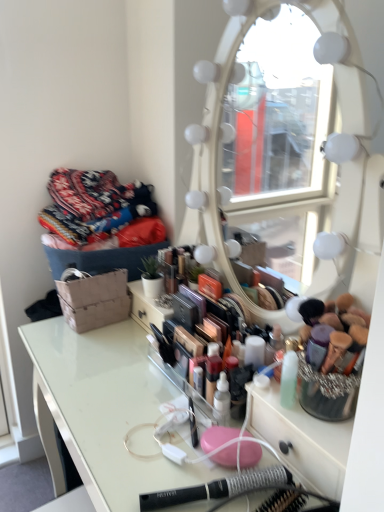
Question: From a real-world perspective, is knitted fabric pile at upper left on clear acrylic table at center?

Choices:
 (A) yes
 (B) no

Answer: (A)

Question: Is knitted fabric pile at upper left turned away from clear acrylic table at center?

Choices:
 (A) no
 (B) yes

Answer: (A)

Question: Can you confirm if knitted fabric pile at upper left is positioned to the right of clear acrylic table at center?

Choices:
 (A) yes
 (B) no

Answer: (B)

Question: Does knitted fabric pile at upper left turn towards clear acrylic table at center?

Choices:
 (A) yes
 (B) no

Answer: (B)

Question: Is knitted fabric pile at upper left positioned beyond the bounds of clear acrylic table at center?

Choices:
 (A) no
 (B) yes

Answer: (B)

Question: Based on their positions, is clear acrylic table at center located to the left or right of black plastic hairbrush at lower center?

Choices:
 (A) right
 (B) left

Answer: (B)

Question: From a real-world perspective, is clear acrylic table at center physically located above or below black plastic hairbrush at lower center?

Choices:
 (A) below
 (B) above

Answer: (A)

Question: From the image's perspective, relative to black plastic hairbrush at lower center, is clear acrylic table at center above or below?

Choices:
 (A) below
 (B) above

Answer: (A)

Question: Considering the positions of point (109, 504) and point (283, 476), is point (109, 504) closer or farther from the camera than point (283, 476)?

Choices:
 (A) farther
 (B) closer

Answer: (A)

Question: Considering their positions, is black plastic hairbrush at lower center located in front of or behind clear acrylic table at center?

Choices:
 (A) front
 (B) behind

Answer: (B)

Question: Is black plastic hairbrush at lower center wider or thinner than clear acrylic table at center?

Choices:
 (A) wide
 (B) thin

Answer: (B)

Question: In terms of size, does black plastic hairbrush at lower center appear bigger or smaller than clear acrylic table at center?

Choices:
 (A) small
 (B) big

Answer: (A)

Question: Is black plastic hairbrush at lower center to the left or to the right of clear acrylic table at center in the image?

Choices:
 (A) right
 (B) left

Answer: (A)

Question: From the image's perspective, is knitted fabric pile at upper left located above or below black plastic hairbrush at lower center?

Choices:
 (A) above
 (B) below

Answer: (A)

Question: Considering the positions of knitted fabric pile at upper left and black plastic hairbrush at lower center in the image, is knitted fabric pile at upper left wider or thinner than black plastic hairbrush at lower center?

Choices:
 (A) thin
 (B) wide

Answer: (B)